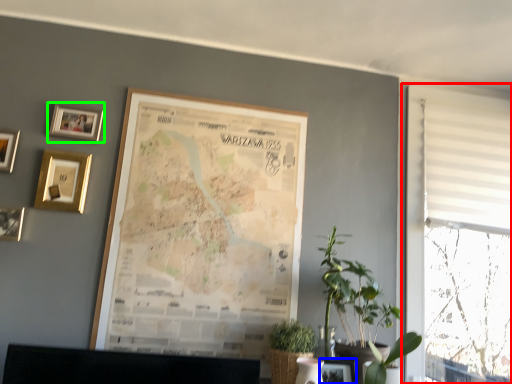
Question: Estimate the real-world distances between objects in this image. Which object is closer to window (highlighted by a red box), picture frame (highlighted by a blue box) or picture frame (highlighted by a green box)?

Choices:
 (A) picture frame
 (B) picture frame

Answer: (A)